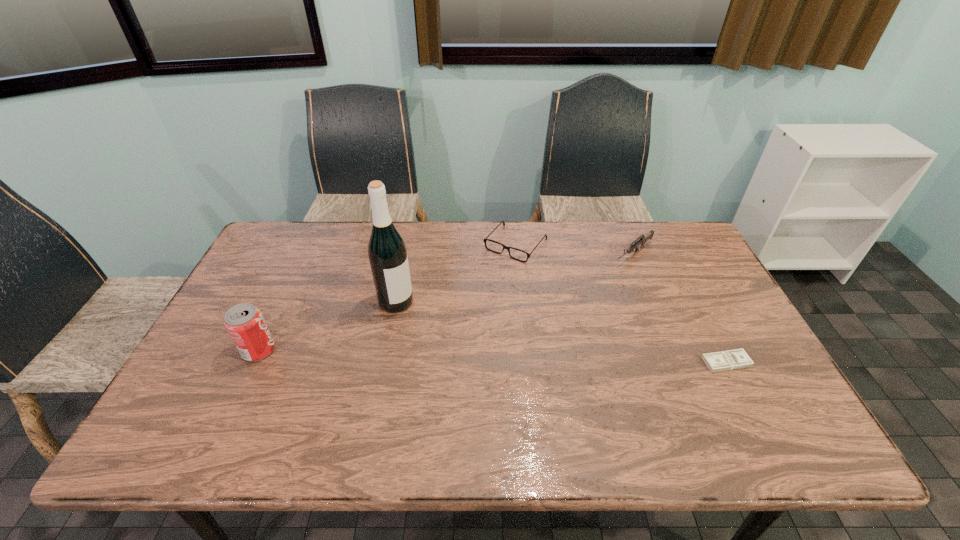
Image resolution: width=960 pixels, height=540 pixels. I want to click on gun located at the far edge, so click(x=642, y=239).

At what (x,y) coordinates should I click in order to perform the action: click on object located at the left edge. Please return your answer as a coordinate pair (x, y). Looking at the image, I should click on (245, 324).

The height and width of the screenshot is (540, 960). Find the location of `money situated at the right edge`. money situated at the right edge is located at coordinates (733, 359).

Where is `gun that is at the right edge`? This screenshot has width=960, height=540. gun that is at the right edge is located at coordinates (642, 239).

You are a GUI agent. You are given a task and a screenshot of the screen. Output one action in this format:
    pyautogui.click(x=<x>, y=<y>)
    Task: Click on the object that is positioned at the far right corner
    Image resolution: width=960 pixels, height=540 pixels.
    Given the screenshot: What is the action you would take?
    pyautogui.click(x=642, y=239)

At what (x,y) coordinates should I click in order to perform the action: click on vacant region at the far edge of the desktop. Please return your answer as a coordinate pair (x, y). Looking at the image, I should click on (353, 225).

Identify the location of vacant region at the near edge of the desktop. 690,403.

At what (x,y) coordinates should I click in order to perform the action: click on blank space at the left edge of the desktop. Please return your answer as a coordinate pair (x, y). This screenshot has height=540, width=960. Looking at the image, I should click on (243, 282).

The image size is (960, 540). I want to click on blank area at the far left corner, so click(307, 243).

I want to click on vacant space at the far right corner, so click(x=678, y=239).